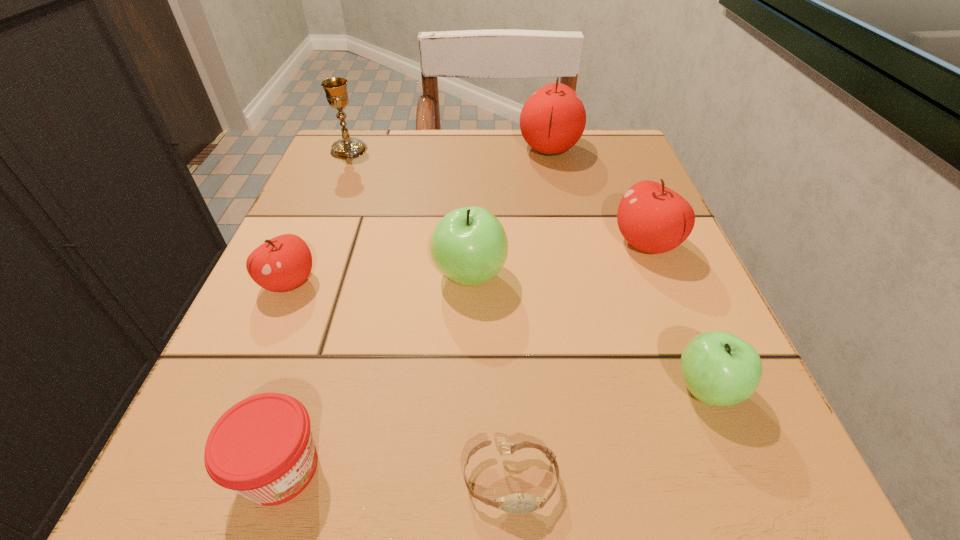
Find the location of a particular element. the third apple from left to right is located at coordinates (552, 120).

This screenshot has height=540, width=960. What are the coordinates of `the farthest apple` in the screenshot? It's located at (552, 120).

You are a GUI agent. You are given a task and a screenshot of the screen. Output one action in this format:
    pyautogui.click(x=<x>, y=<y>)
    Task: Click on the chalice
    Image resolution: width=960 pixels, height=540 pixels.
    Given the screenshot: What is the action you would take?
    (x=335, y=88)

You are a GUI agent. You are given a task and a screenshot of the screen. Output one action in this format:
    pyautogui.click(x=<x>, y=<y>)
    Task: Click on the bigger green apple
    Image resolution: width=960 pixels, height=540 pixels.
    Given the screenshot: What is the action you would take?
    pyautogui.click(x=469, y=245)

At what (x,y) coordinates should I click in order to perform the action: click on the left green apple. Please return your answer as a coordinate pair (x, y). The image size is (960, 540). Looking at the image, I should click on (469, 245).

Find the location of a particular element. Image resolution: width=960 pixels, height=540 pixels. the rightmost red apple is located at coordinates (654, 219).

The height and width of the screenshot is (540, 960). I want to click on the smallest red apple, so tap(283, 263).

At what (x,y) coordinates should I click in order to perform the action: click on the leftmost red apple. Please return your answer as a coordinate pair (x, y). This screenshot has height=540, width=960. Looking at the image, I should click on (283, 263).

At what (x,y) coordinates should I click in order to perform the action: click on the smaller green apple. Please return your answer as a coordinate pair (x, y). Image resolution: width=960 pixels, height=540 pixels. Looking at the image, I should click on (719, 368).

Where is `the nearest apple`? the nearest apple is located at coordinates (719, 368).